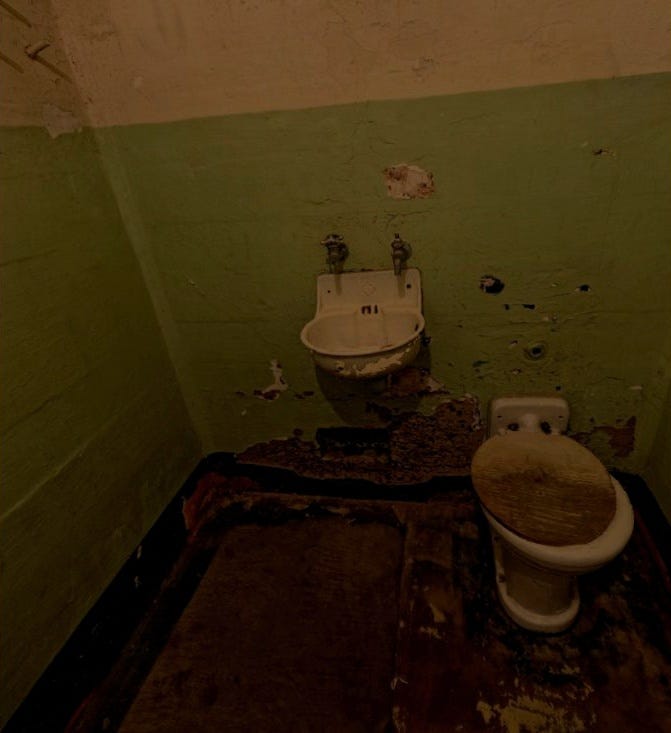
This screenshot has height=733, width=671. In order to click on toiler bowl in this screenshot , I will do `click(604, 544)`.